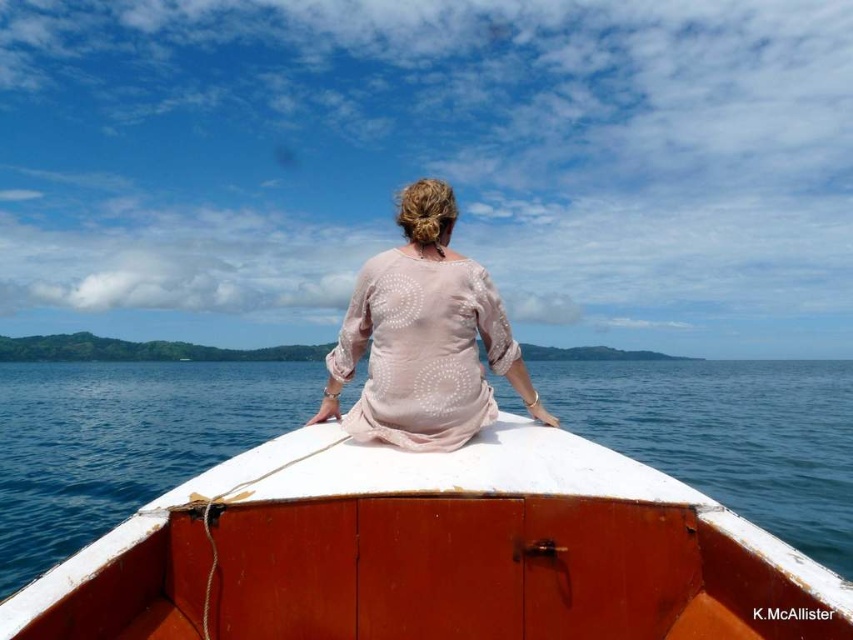
Question: Among these points, which one is nearest to the camera?

Choices:
 (A) (473, 572)
 (B) (445, 428)

Answer: (A)

Question: Is white matte boat at center closer to camera compared to pink sheer blouse at center?

Choices:
 (A) no
 (B) yes

Answer: (B)

Question: Can you confirm if white matte boat at center is wider than pink sheer blouse at center?

Choices:
 (A) no
 (B) yes

Answer: (B)

Question: Is white matte boat at center in front of pink sheer blouse at center?

Choices:
 (A) yes
 (B) no

Answer: (A)